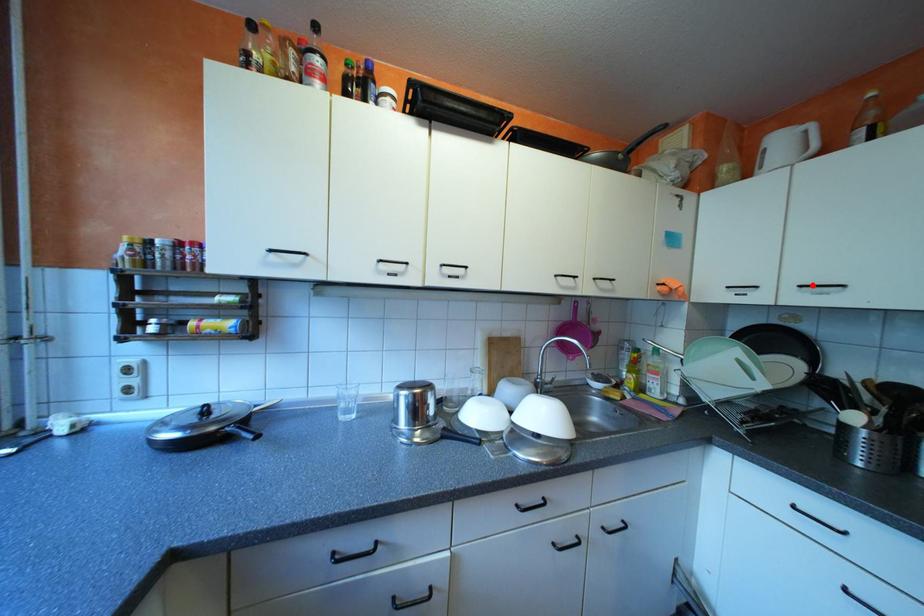
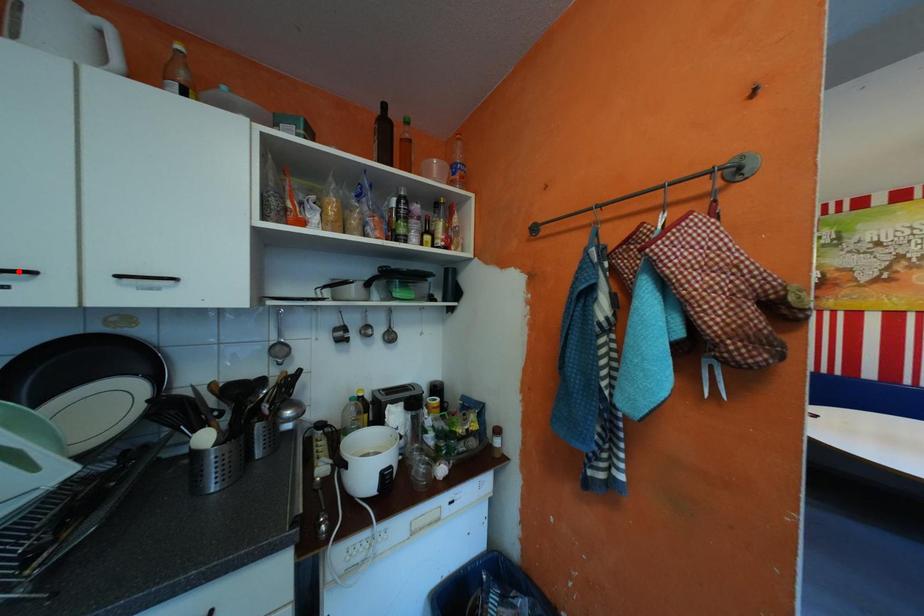
I am providing you with two images of the same scene from different viewpoints. A red point is marked on the first image and another point is marked on the second image. Are the points marked in image1 and image2 representing the same 3D position?

No